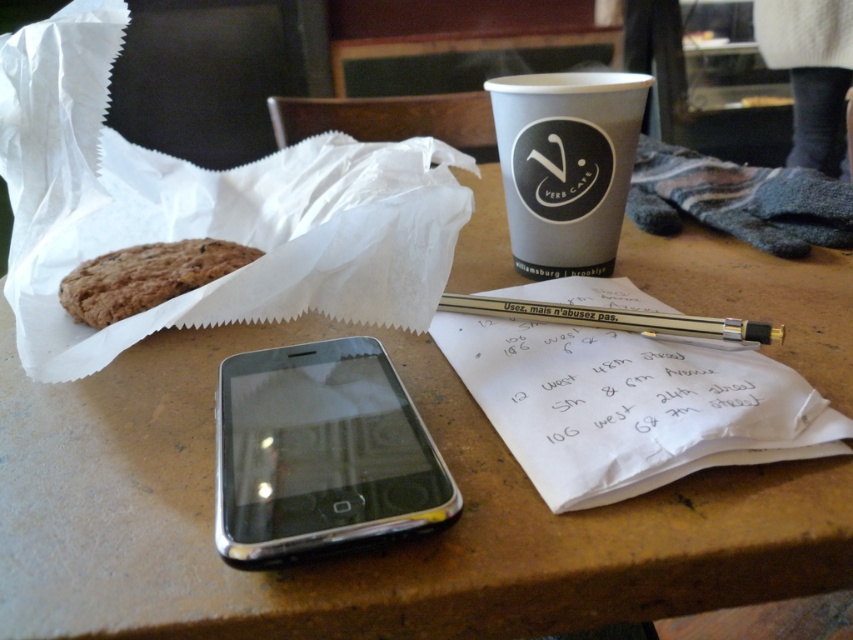
Does white paper with handwritten notes at center appear on the left side of gray paper cup at upper center?

No, white paper with handwritten notes at center is not to the left of gray paper cup at upper center.

Does white paper with handwritten notes at center appear on the right side of gray paper cup at upper center?

Correct, you'll find white paper with handwritten notes at center to the right of gray paper cup at upper center.

Where is `white paper with handwritten notes at center`? This screenshot has width=853, height=640. white paper with handwritten notes at center is located at coordinates (616, 388).

At what (x,y) coordinates should I click in order to perform the action: click on white paper with handwritten notes at center. Please return your answer as a coordinate pair (x, y). This screenshot has width=853, height=640. Looking at the image, I should click on (616, 388).

What do you see at coordinates (566, 164) in the screenshot? I see `gray paper cup at upper center` at bounding box center [566, 164].

Is point (573, 273) positioned behind point (666, 330)?

Yes, point (573, 273) is farther from viewer.

This screenshot has height=640, width=853. I want to click on gray paper cup at upper center, so click(x=566, y=164).

Is silver metallic smartphone at center wider than brown crumbly cookie at upper left?

In fact, silver metallic smartphone at center might be narrower than brown crumbly cookie at upper left.

Can you confirm if silver metallic smartphone at center is smaller than brown crumbly cookie at upper left?

No.

Is point (328, 348) closer to viewer compared to point (173, 256)?

Yes.

Find the location of a particular element. The image size is (853, 640). silver metallic smartphone at center is located at coordinates (320, 452).